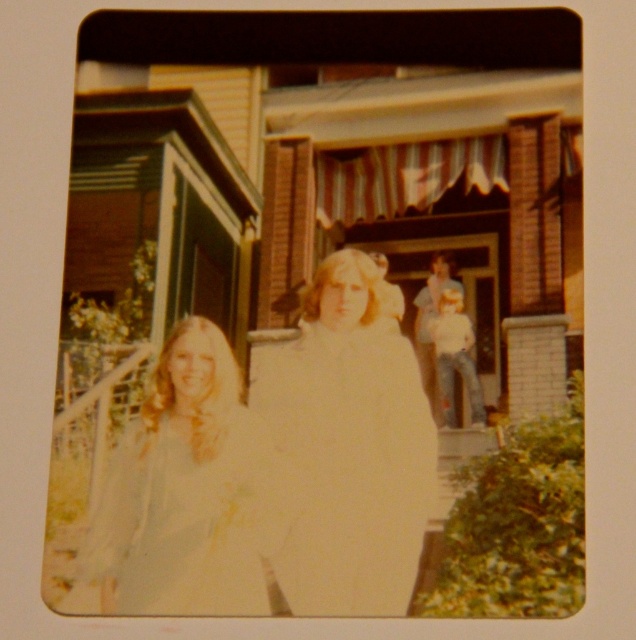
You are a photographer reviewing an old photo. In the image, there are two dresses visible. The white cotton dress at center and the light blue fabric dress at left. Which dress is more to the right in the photo?

The white cotton dress at center is more to the right side of the light blue fabric dress at left.

In the vintage photograph, there are two dresses visible. The white cotton dress at center and the light blue fabric dress at left. Which dress is wider?

The white cotton dress at center might be wider than light blue fabric dress at left according to the description provided.

In the scene shown: You are a photographer trying to capture a clear shot of both the white cotton dress at center and the light blue fabric dress at left. Given that your camera has a depth of field that can focus on objects within a 25 inch range, will both dresses be in focus?

The distance between the white cotton dress at center and the light blue fabric dress at left is 26.22 inches. Since the camera can only focus within a 25 inch range, the dresses are slightly out of the depth of field range, so they might not both be in focus.